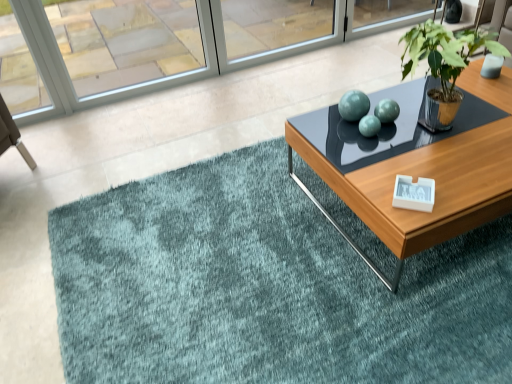
Find the location of a particular element. The image size is (512, 384). vacant space in front of green metallic plant pot at upper right is located at coordinates (451, 172).